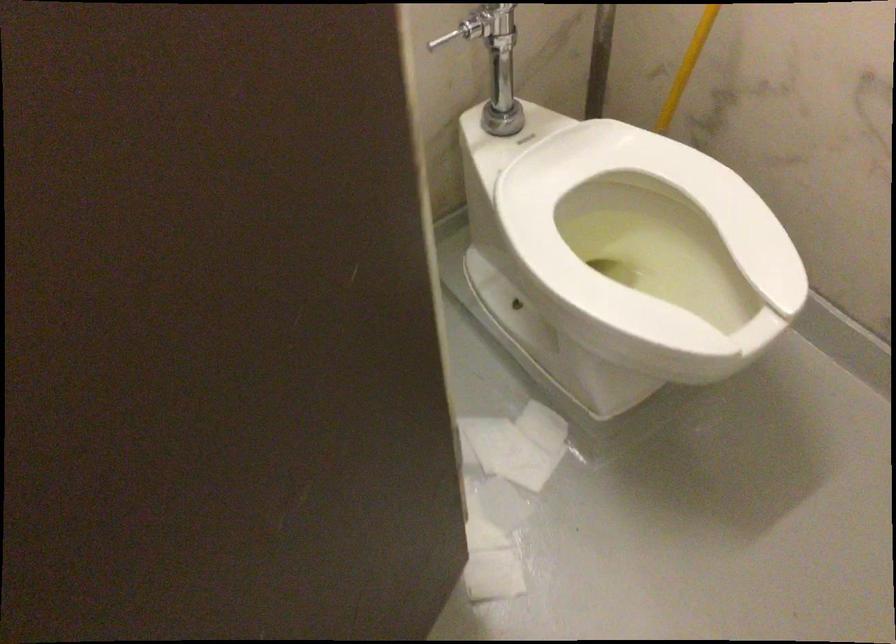
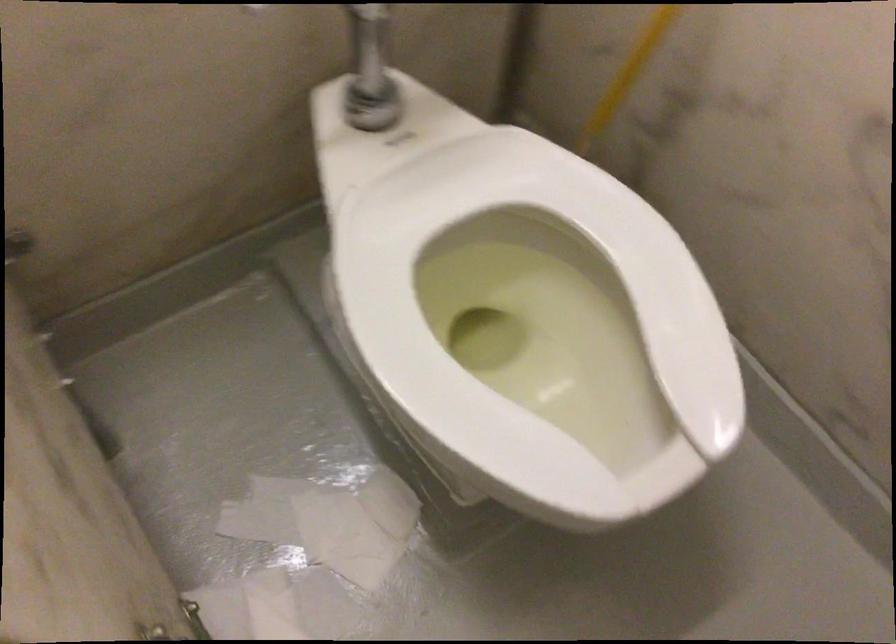
The point at (488,438) is marked in the first image. Where is the corresponding point in the second image?

(320, 529)